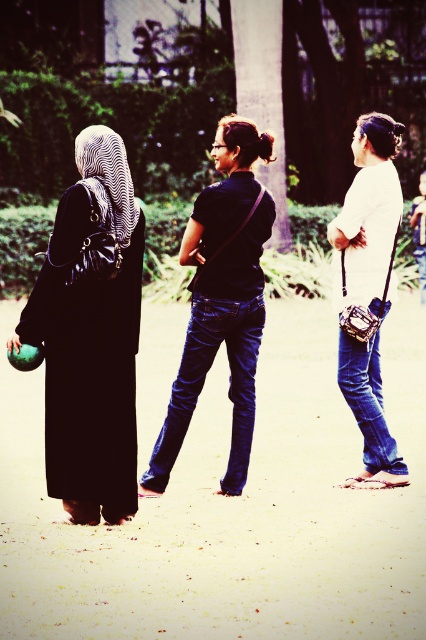
Question: Which point is farther to the camera?

Choices:
 (A) (98, 202)
 (B) (377, 456)
 (C) (242, 134)

Answer: (B)

Question: Does matte black dress at left have a smaller size compared to blue denim jeans at center?

Choices:
 (A) no
 (B) yes

Answer: (A)

Question: Is black matte shirt at center below blue denim jeans at center?

Choices:
 (A) yes
 (B) no

Answer: (B)

Question: Considering the relative positions of matte black dress at left and jeans at center in the image provided, where is matte black dress at left located with respect to jeans at center?

Choices:
 (A) above
 (B) below

Answer: (A)

Question: Which of the following is the closest to the observer?

Choices:
 (A) matte black dress at left
 (B) white matte camera bag at center

Answer: (A)

Question: Which of the following is the closest to the observer?

Choices:
 (A) (345, 337)
 (B) (380, 228)
 (C) (247, 337)
 (D) (124, 154)

Answer: (D)